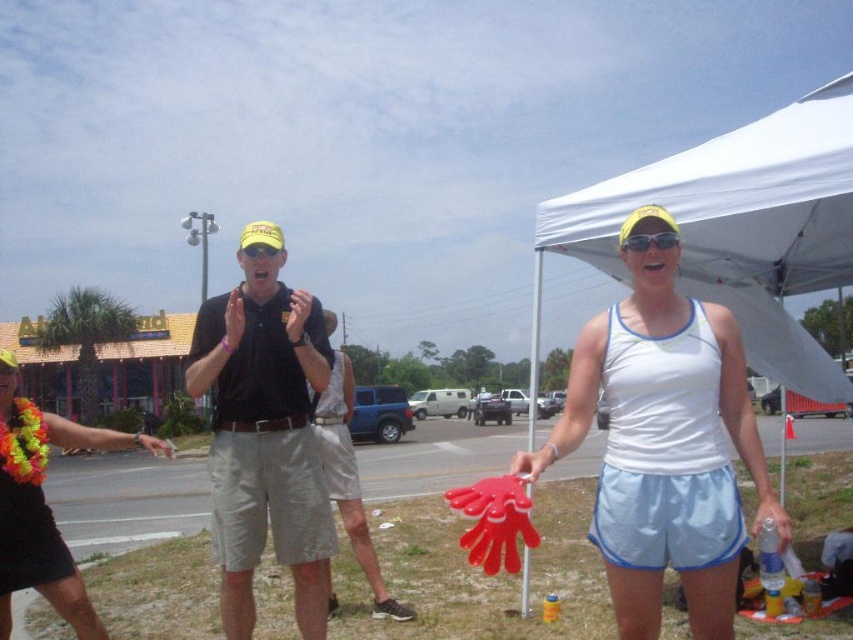
Who is positioned more to the right, white fabric canopy at upper right or black matte shirt at center?

white fabric canopy at upper right is more to the right.

Locate an element on the screen. The image size is (853, 640). white fabric canopy at upper right is located at coordinates (741, 227).

Can you confirm if white fabric tank top at center is positioned to the left of floral lei at center?

Incorrect, white fabric tank top at center is not on the left side of floral lei at center.

Is the position of white fabric tank top at center less distant than that of floral lei at center?

Yes, it is.

Does point (627, 612) lie in front of point (28, 413)?

Yes, it is in front of point (28, 413).

The width and height of the screenshot is (853, 640). What are the coordinates of `white fabric tank top at center` in the screenshot? It's located at (664, 444).

Between white fabric tank top at center and sunglassestransparent at upper center, which one has more height?

white fabric tank top at center

What do you see at coordinates (664, 444) in the screenshot? The height and width of the screenshot is (640, 853). I see `white fabric tank top at center` at bounding box center [664, 444].

Which is in front, point (712, 627) or point (666, 244)?

Positioned in front is point (712, 627).

I want to click on white fabric tank top at center, so [x=664, y=444].